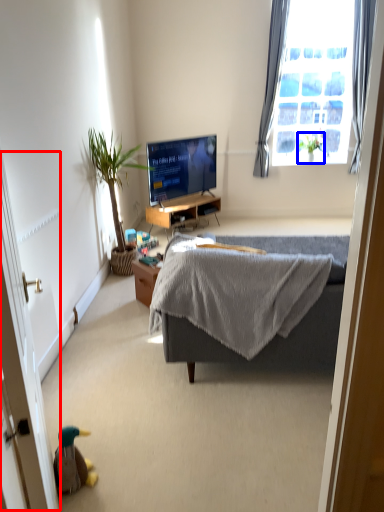
Question: Which object appears farthest to the camera in this image, screen door (highlighted by a red box) or houseplant (highlighted by a blue box)?

Choices:
 (A) screen door
 (B) houseplant

Answer: (B)